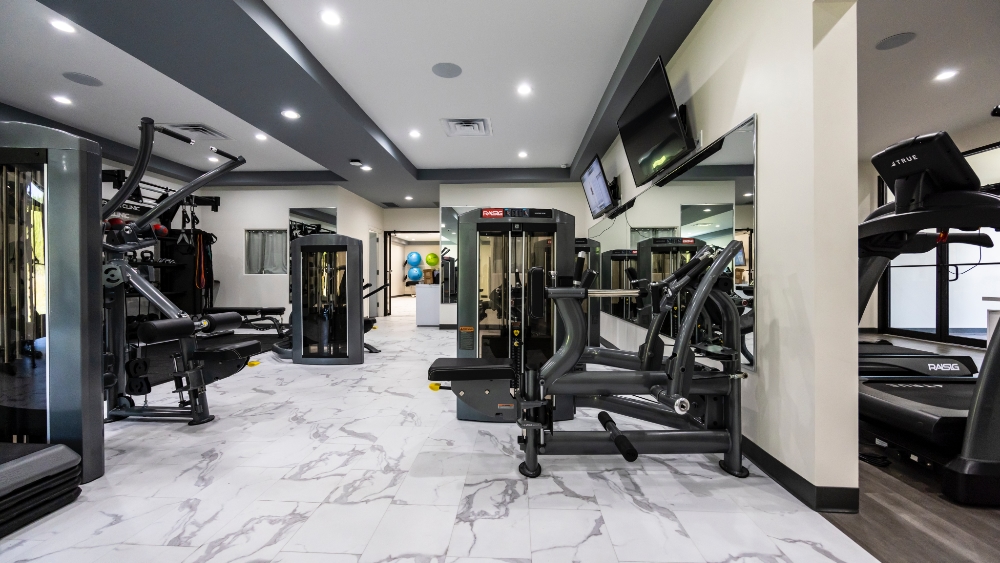
You are a GUI agent. You are given a task and a screenshot of the screen. Output one action in this format:
    pyautogui.click(x=<x>, y=<y>)
    Task: Click on the mirrors
    
    Given the screenshot: What is the action you would take?
    pyautogui.click(x=670, y=214), pyautogui.click(x=446, y=238), pyautogui.click(x=308, y=222)